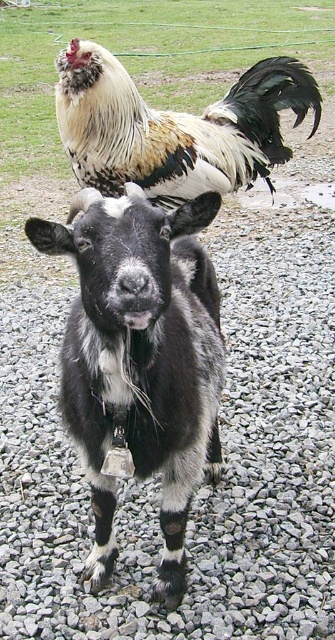
You are a photographer standing at the camera position. You want to take a closeup photo of the black and white fur goat at center. Considering the goat is 4.10 feet away from you, can you step forward to get closer without leaving the gravel surface?

The black and white fur goat at center is 4.10 feet from the camera. Since you can step forward on the gravel surface, you can move closer to take the closeup photo.

You are a farmer checking the height of your animals. You have a black and white fur goat at center and a golden brown feathers at upper center. Which animal is taller?

The black and white fur goat at center is taller than the golden brown feathers at upper center.

From the picture: You are a photographer trying to capture both the black and white fur goat at center and the golden brown feathers at upper center in a single shot. Since the goat is blocking part of the rooster, will you need to adjust your position to include both in the frame?

The black and white fur goat at center is closer to the viewer than the golden brown feathers at upper center, so you will need to adjust your position to ensure both are visible without the goat blocking the rooster.